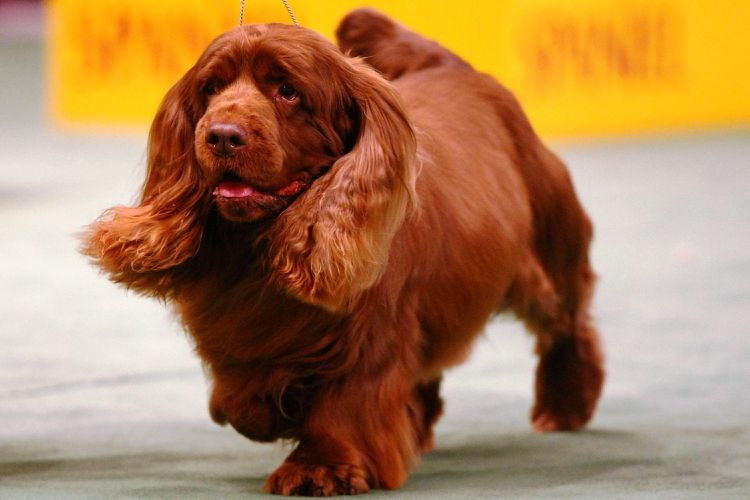
You are a GUI agent. You are given a task and a screenshot of the screen. Output one action in this format:
    pyautogui.click(x=<x>, y=<y>)
    Task: Click on the floor
    
    Given the screenshot: What is the action you would take?
    pyautogui.click(x=630, y=445)